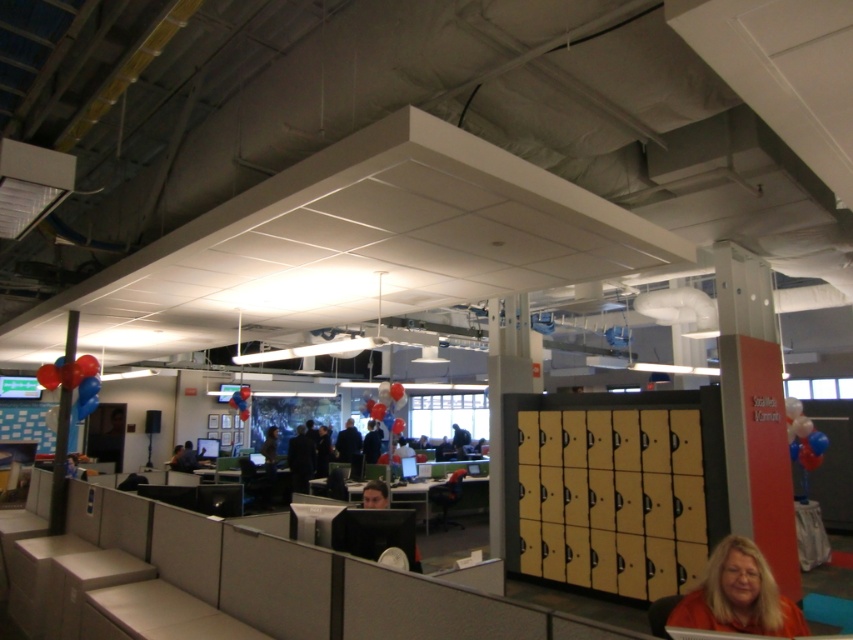
In the scene shown: You are an office worker who needs to hang a small poster. You have two options to place it either on the shiny metallic balloons at left or the matte black monitor at center. Which object is located higher up so that the poster will be more visible?

The shiny metallic balloons at left are located above the matte black monitor at center, so placing the poster there would make it more visible.

You are an office worker who wants to hang a new poster on the wall between the shiny metallic balloons at left and the matte black monitor at center. Since the balloons are lower than the monitor, where should you place the poster to ensure it is centered between them?

The shiny metallic balloons at left has a lesser height compared to matte black monitor at center, so you should hang the poster slightly lower than the center point between them to account for the difference in height.

You are standing at the entrance of the office and see a point marked at coordinates (738, 595). Based on the office layout described, can you determine what surface this point is located on?

The point at coordinates (738, 595) is located on the orange fabric at lower right.